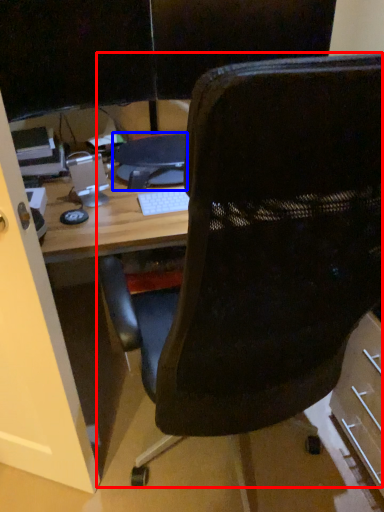
Question: Which object is further to the camera taking this photo, chair (highlighted by a red box) or computer (highlighted by a blue box)?

Choices:
 (A) chair
 (B) computer

Answer: (B)